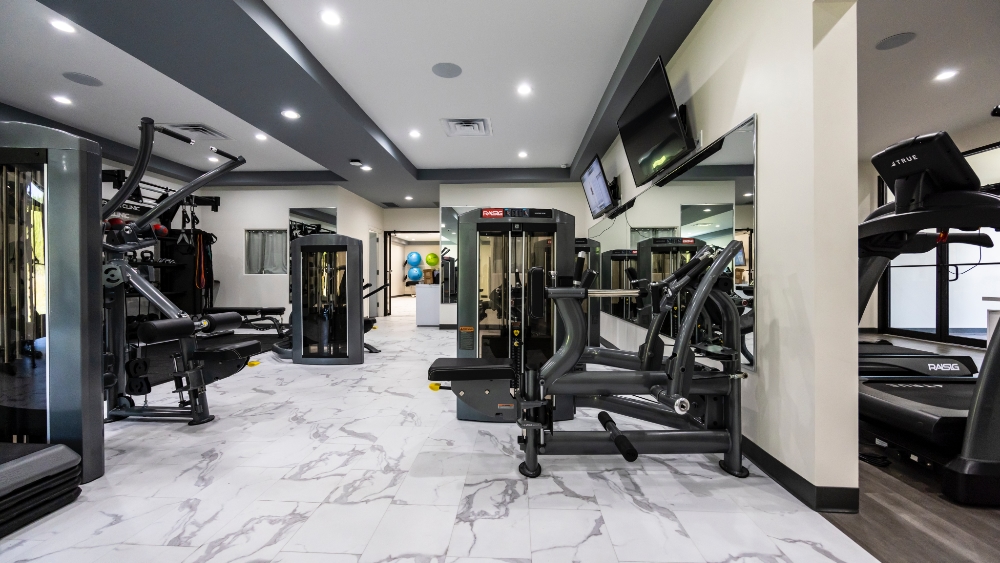
Where is `doors`? Image resolution: width=1000 pixels, height=563 pixels. doors is located at coordinates (958, 283), (388, 258), (376, 262).